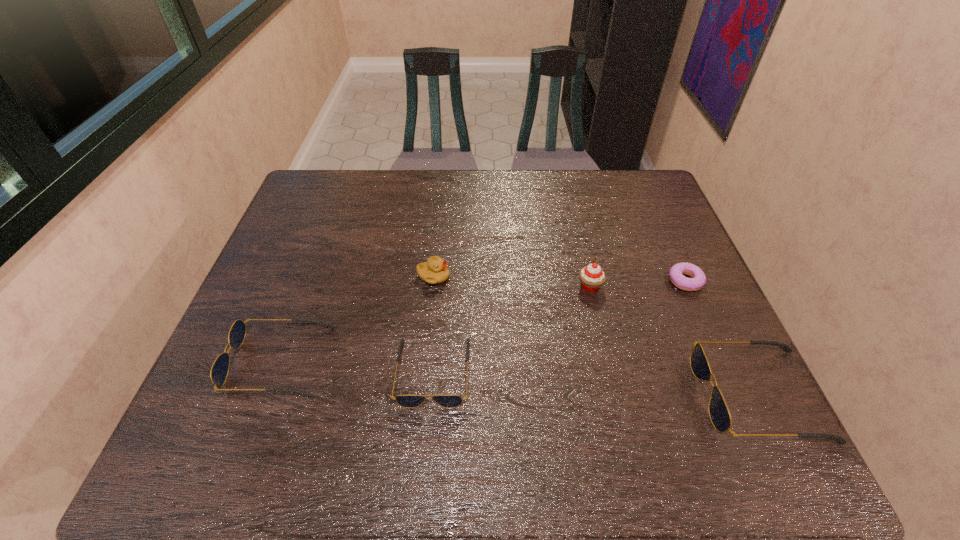
You are a GUI agent. You are given a task and a screenshot of the screen. Output one action in this format:
    pyautogui.click(x=<x>, y=<y>)
    Task: Click on the leftmost sunglasses
    This screenshot has height=540, width=960.
    Given the screenshot: What is the action you would take?
    pyautogui.click(x=219, y=371)

Where is `the leftmost object`? The width and height of the screenshot is (960, 540). the leftmost object is located at coordinates (219, 371).

You are a GUI agent. You are given a task and a screenshot of the screen. Output one action in this format:
    pyautogui.click(x=<x>, y=<y>)
    Task: Click on the second shortest object
    
    Given the screenshot: What is the action you would take?
    pyautogui.click(x=406, y=401)

Locate an element on the screen. This screenshot has width=960, height=540. the second sunglasses from left to right is located at coordinates (406, 401).

This screenshot has height=540, width=960. What are the coordinates of `the rightmost sunglasses` in the screenshot? It's located at (719, 413).

Identify the location of the tallest object. (592, 276).

This screenshot has height=540, width=960. What are the coordinates of `cupcake` in the screenshot? It's located at (592, 276).

Identify the location of the shortest object. The image size is (960, 540). (698, 279).

Find the location of a particular element. The image size is (960, 540). duckling is located at coordinates (434, 271).

Find the location of a particular element. This screenshot has height=540, width=960. vacant space located on the front-facing side of the rightmost sunglasses is located at coordinates (639, 395).